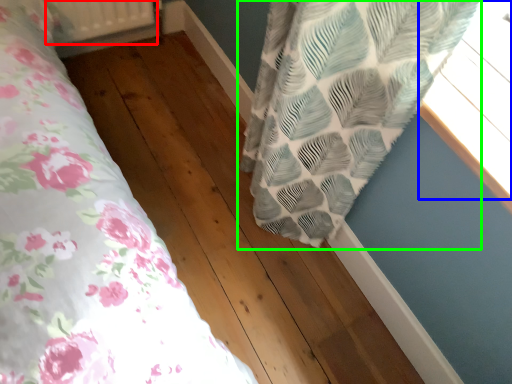
Question: Which object is the farthest from radiator (highlighted by a red box)? Choose among these: window (highlighted by a blue box) or curtain (highlighted by a green box).

Choices:
 (A) window
 (B) curtain

Answer: (A)